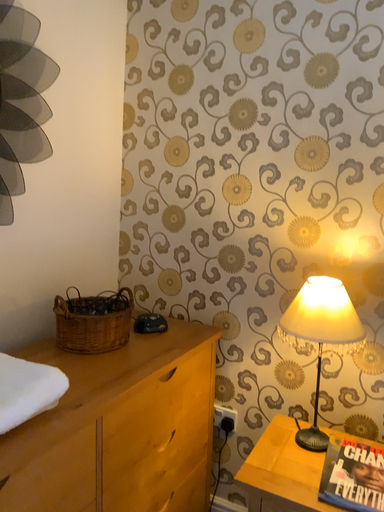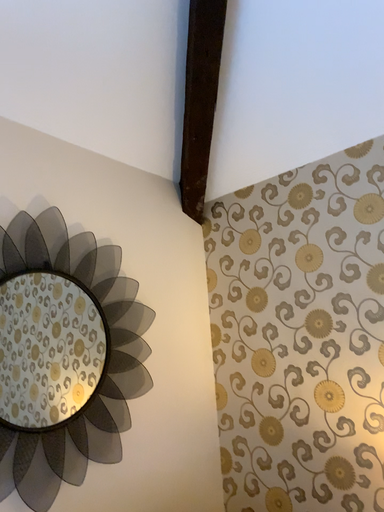
Question: How did the camera likely rotate when shooting the video?

Choices:
 (A) rotated upward
 (B) rotated downward

Answer: (A)